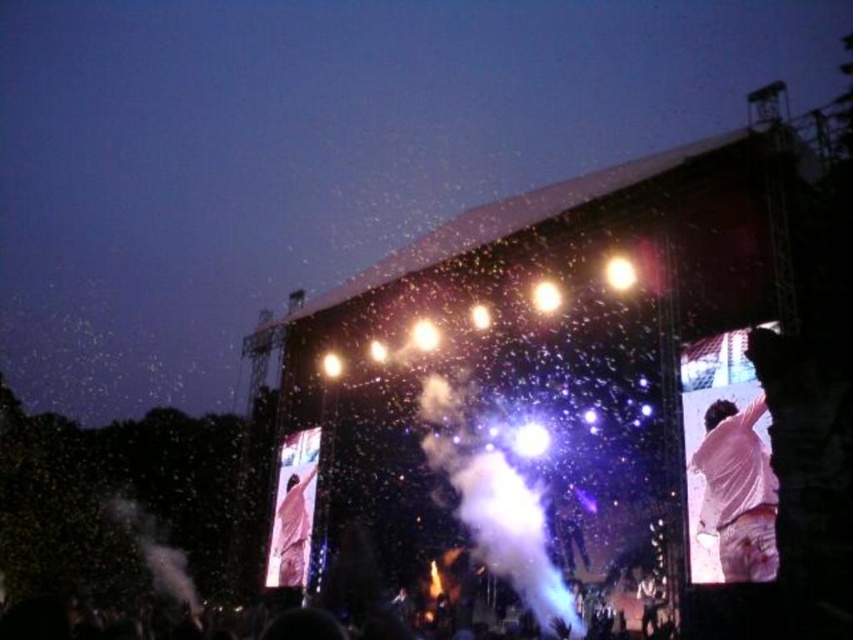
You are a stagehand who needs to place a 10 feet ladder to reach the white matte shirt at upper right from your current position. Can you safely do this without the ladder exceeding the stage area?

The white matte shirt at upper right is 177.80 feet away from your current position. Since the ladder is only 10 feet long, it is not long enough to reach the white matte shirt at upper right. Therefore, you cannot safely place the ladder to reach it without exceeding the stage area.

You are standing at point [300,634]. The stage is 70.14 meters away from you. If you walk straight towards the stage, will you be able to see the performers clearly?

The distance between you and the stage is 70.14 meters, so you might not be able to see the performers clearly from that distance.

You are a photographer standing at the front of the stage. You want to take a photo that includes both the white matte shirt at upper right and the black matte crowd at lower center. Given that your camera has a maximum zoom range of 20 meters, will you be able to capture both subjects in a single frame without moving your position?

The white matte shirt at upper right and the black matte crowd at lower center are 23.19 meters apart from each other. Since the camera can only zoom up to 20 meters, you will not be able to capture both subjects in a single frame without moving your position.